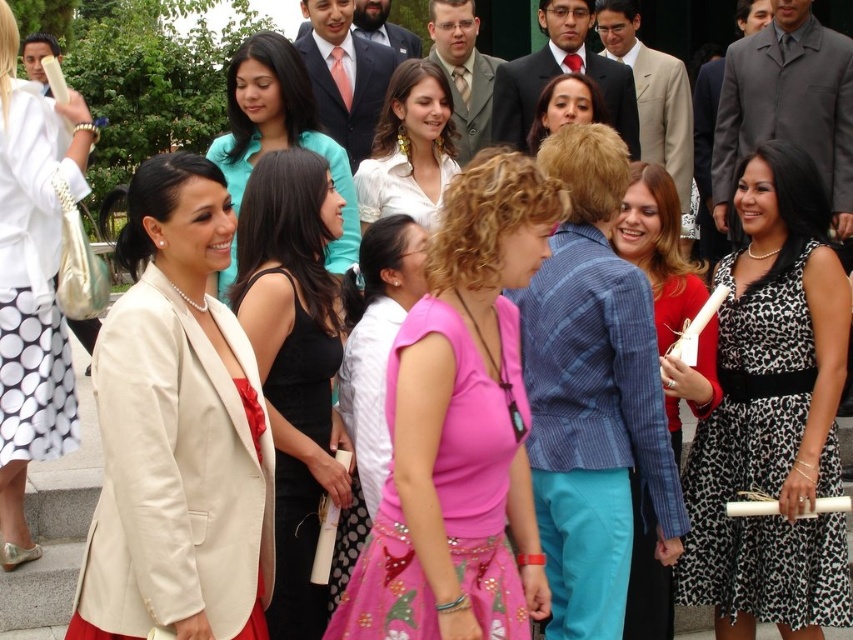
Does white dotted skirt at lower left have a lesser width compared to matte black suit at center?

Indeed, white dotted skirt at lower left has a lesser width compared to matte black suit at center.

Who is more forward, (16, 346) or (618, 84)?

Point (16, 346) is in front.

Describe the element at coordinates (32, 285) in the screenshot. This screenshot has width=853, height=640. I see `white dotted skirt at lower left` at that location.

Where is `white dotted skirt at lower left`? The height and width of the screenshot is (640, 853). white dotted skirt at lower left is located at coordinates (32, 285).

Who is shorter, black satin dress at center or matte pink blouse at center?

With less height is black satin dress at center.

Can you confirm if black satin dress at center is positioned below matte pink blouse at center?

Yes.

Does point (258, 296) lie behind point (537, 102)?

No, it is in front of (537, 102).

Identify the location of black satin dress at center. (294, 362).

Can you confirm if dark gray suit at center is wider than teal satin blouse at upper center?

No.

Is point (749, 140) positioned before point (236, 115)?

No, (749, 140) is behind (236, 115).

At what (x,y) coordinates should I click in order to perform the action: click on dark gray suit at center. Please return your answer as a coordinate pair (x, y). Image resolution: width=853 pixels, height=640 pixels. Looking at the image, I should click on (787, 104).